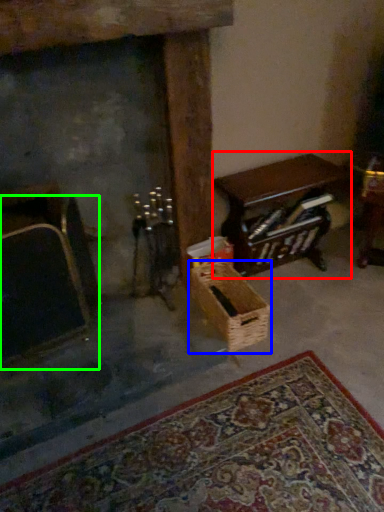
Question: Which is farther away from table (highlighted by a red box)? basket (highlighted by a blue box) or armchair (highlighted by a green box)?

Choices:
 (A) basket
 (B) armchair

Answer: (B)